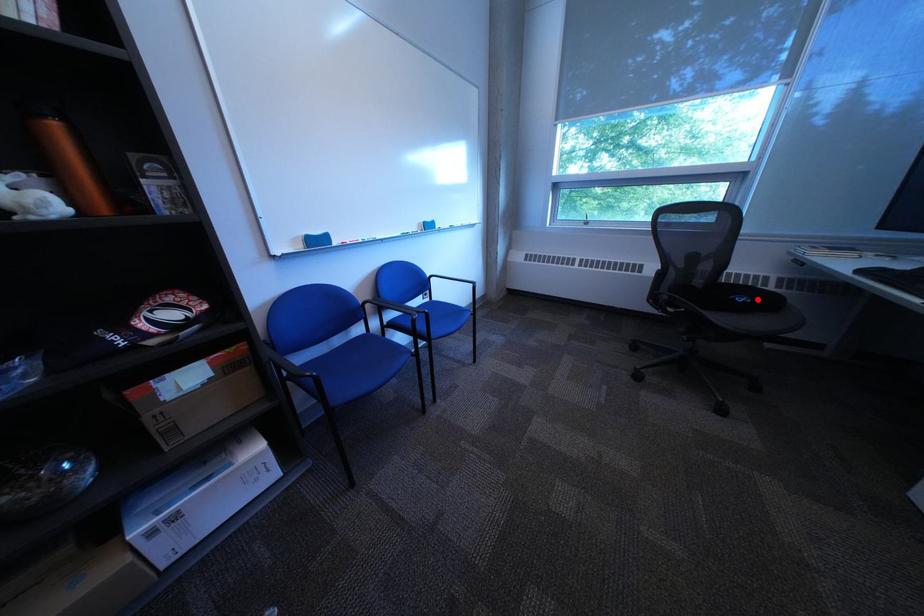
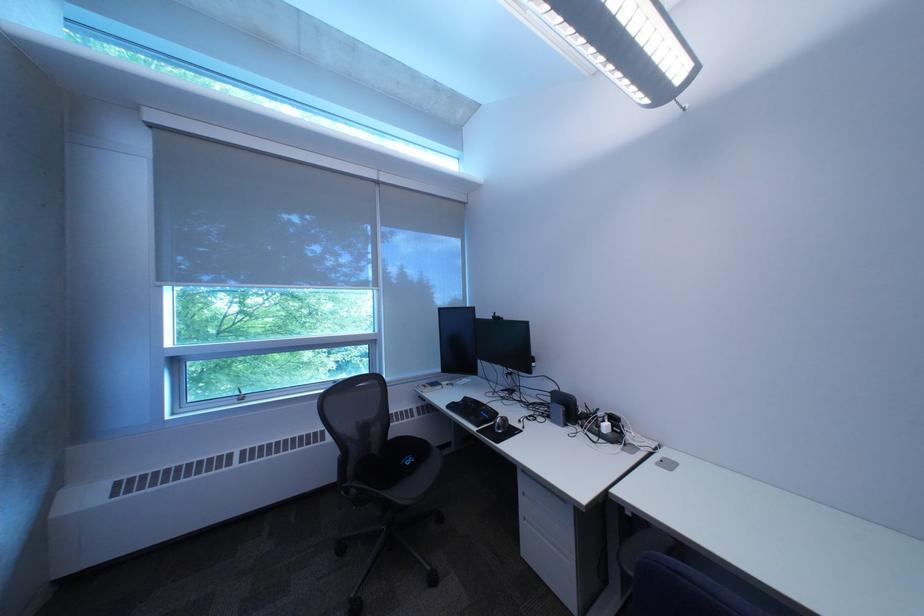
Where in the second image is the point corresponding to the highlighted location from the first image?

(423, 461)